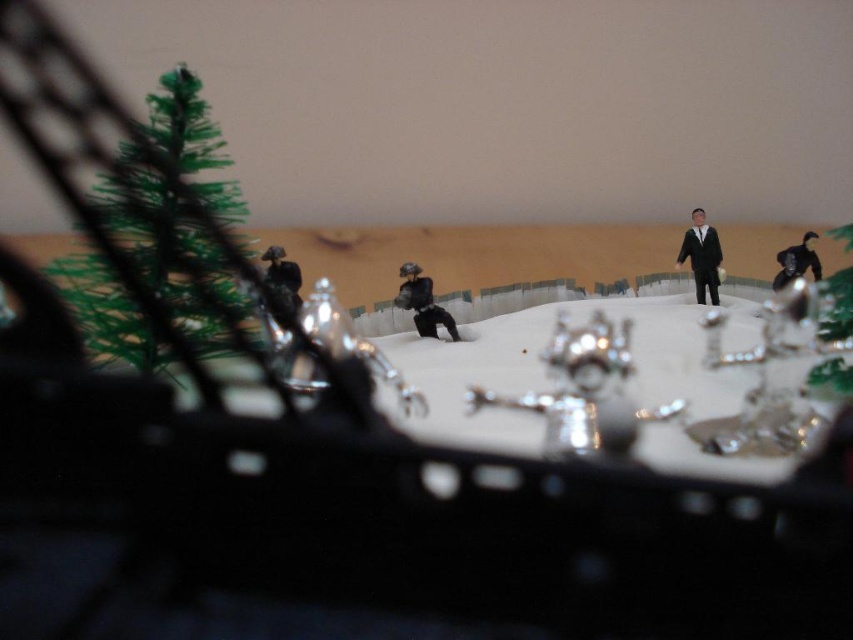
Where is the matte black figure at center located in the scene?

The matte black figure at center is located at point coordinates of approximately 0.473 on the x axis and 0.496 on the y axis.

You are a game player trying to move your character in the diorama. Your character is the matte black figure at center. There is an obstacle, the black matte suit at center. Can you move forward past the obstacle?

The matte black figure at center is behind the black matte suit at center, so the matte black figure at center can move forward past the obstacle.